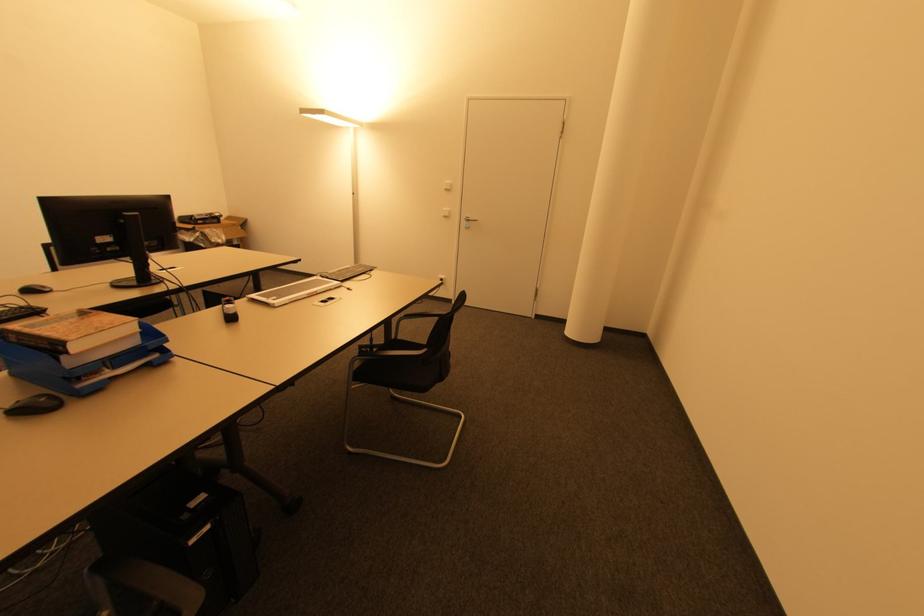
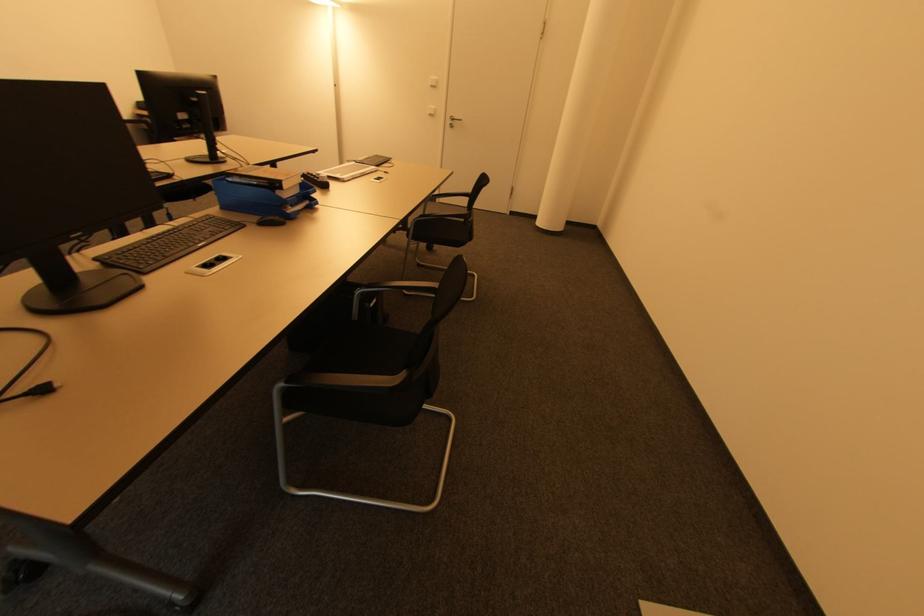
Find the pixel in the second image that matches pixel 448 190 in the first image.

(434, 87)